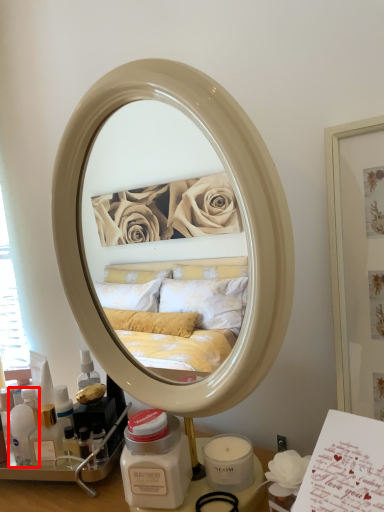
Question: From the image's perspective, where is toiletry (annotated by the red box) located relative to vanity?

Choices:
 (A) below
 (B) above

Answer: (A)